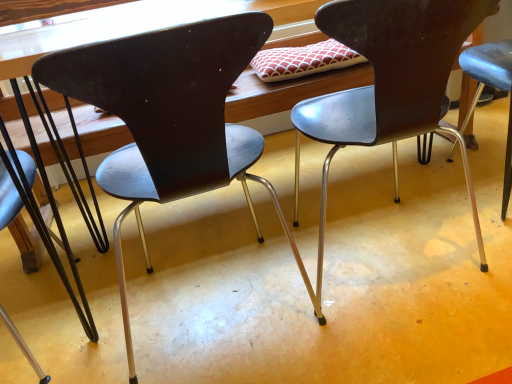
Where is `free space between metallic dark brown chair at left, which is the 1th chair in left-to-right order, and matte black chair at center, the second chair viewed from the right`? This screenshot has width=512, height=384. free space between metallic dark brown chair at left, which is the 1th chair in left-to-right order, and matte black chair at center, the second chair viewed from the right is located at coordinates (112, 313).